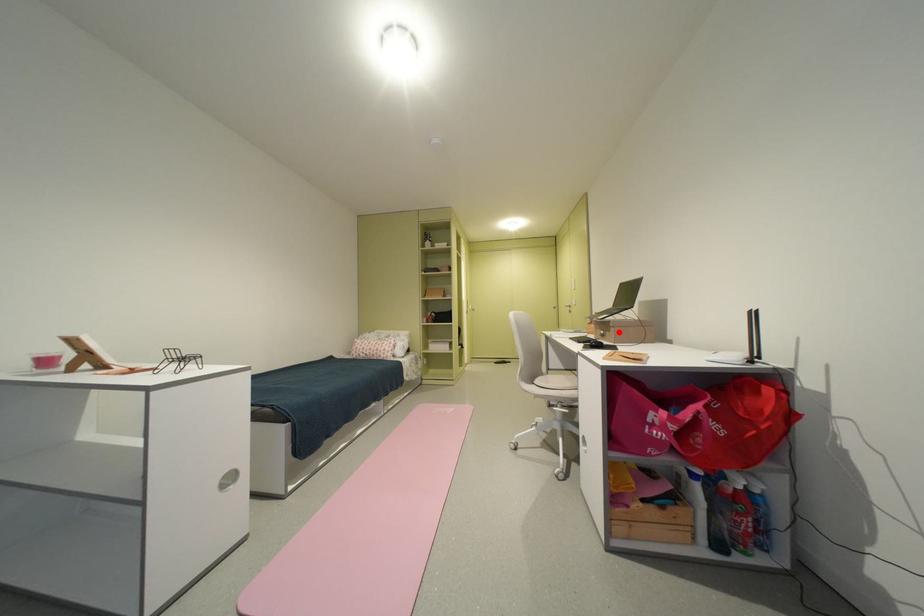
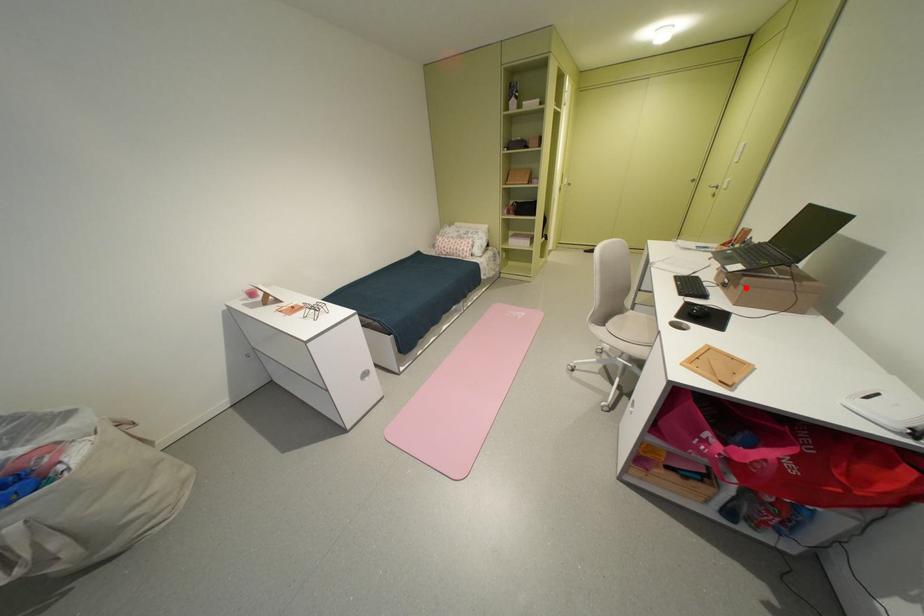
I am providing you with two images of the same scene from different viewpoints. A red point is marked on the first image and another point is marked on the second image. Are the points marked in image1 and image2 representing the same 3D position?

Yes